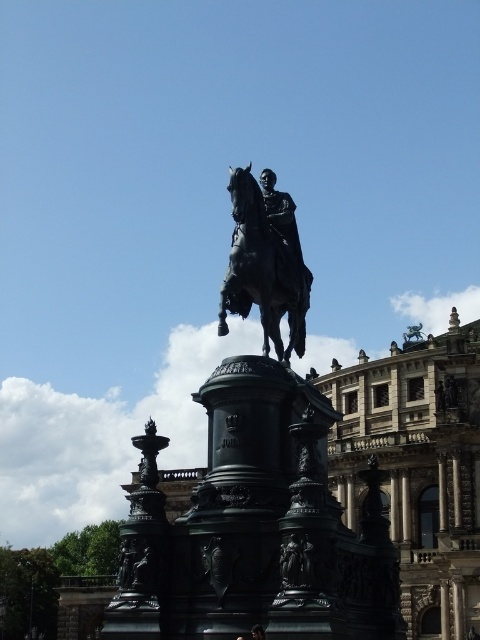
You are standing in front of the equestrian statue. Where exactly is the shiny black horse at center located in terms of coordinates?

The shiny black horse at center is located at point coordinates of (265, 260).

You are an art student analyzing the statue and its horse. Based on the scene, which object, the black polished statue at center or the shiny black horse at center, has a greater width?

The black polished statue at center might be wider than shiny black horse at center.

You are a tourist standing in front of the statue and want to take a photo of the dark brown hair at center and the black polished statue at center. Based on their positions, which one should you focus on first to ensure both are in frame?

The dark brown hair at center is to the left of the black polished statue at center, so you should focus on the dark brown hair at center first to ensure both are in frame.